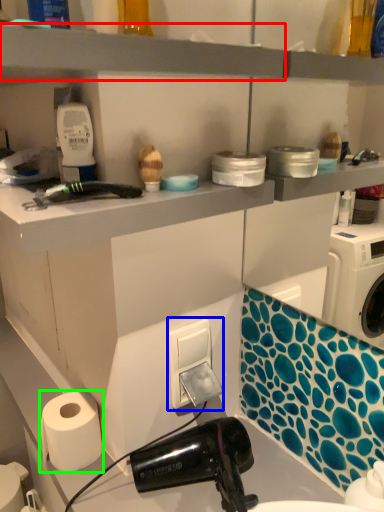
Question: Which is nearer to the shelf (highlighted by a red box)? electric outlet (highlighted by a blue box) or paper towel (highlighted by a green box).

Choices:
 (A) electric outlet
 (B) paper towel

Answer: (A)